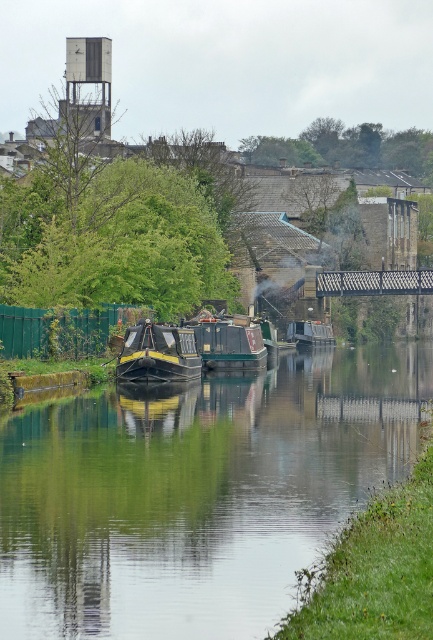
Question: Estimate the real-world distances between objects in this image. Which object is farther from the black polished wood boat at center?

Choices:
 (A) metallic grid bridge at center
 (B) metallic silver boat at center
 (C) green glossy water at center

Answer: (A)

Question: Which of the following is the closest to the observer?

Choices:
 (A) (314, 333)
 (B) (171, 566)

Answer: (B)

Question: From the image, what is the correct spatial relationship of green wooden boat at center in relation to metallic grid bridge at center?

Choices:
 (A) below
 (B) above

Answer: (A)

Question: Does green glossy water at center have a smaller size compared to black polished wood boat at center?

Choices:
 (A) yes
 (B) no

Answer: (B)

Question: Which of these objects is positioned farthest from the green wooden boat at center?

Choices:
 (A) black polished wood boat at center
 (B) metallic silver boat at center

Answer: (B)

Question: Can you confirm if green glossy water at center is positioned below metallic grid bridge at center?

Choices:
 (A) yes
 (B) no

Answer: (A)